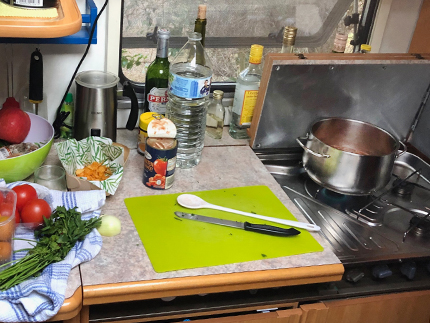
Image resolution: width=430 pixels, height=323 pixels. I want to click on bottles, so click(x=190, y=116).